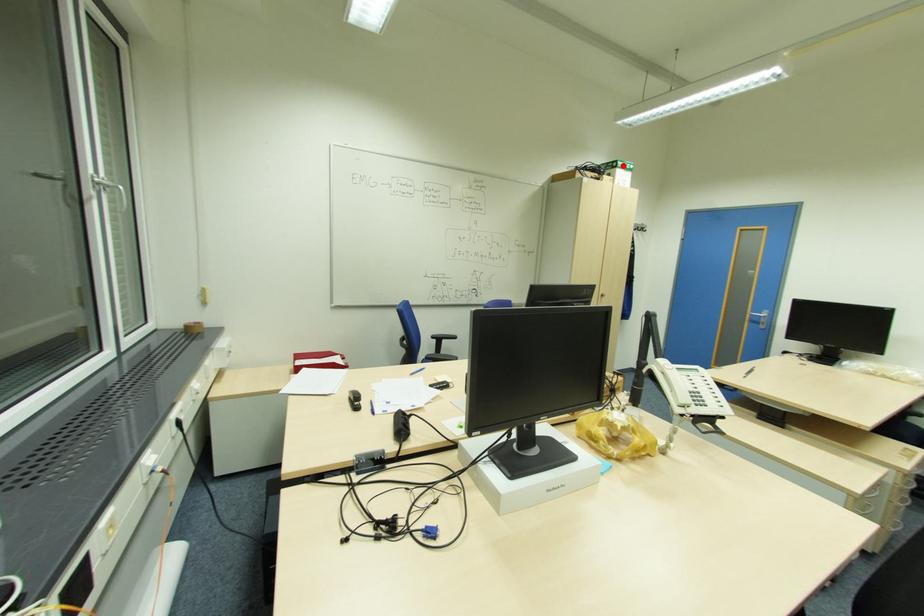
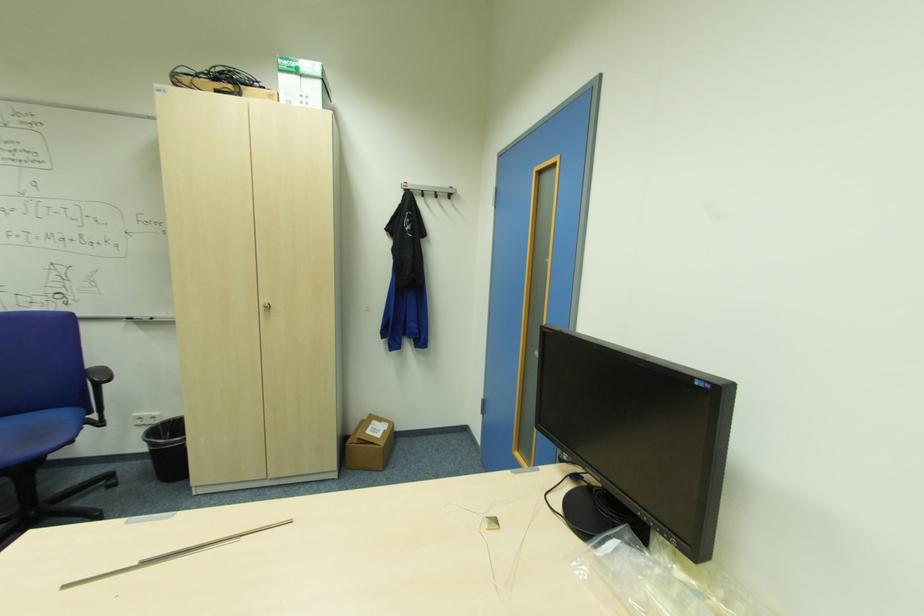
Where in the second image is the point corresponding to the highlighted location from the first image?

(287, 69)